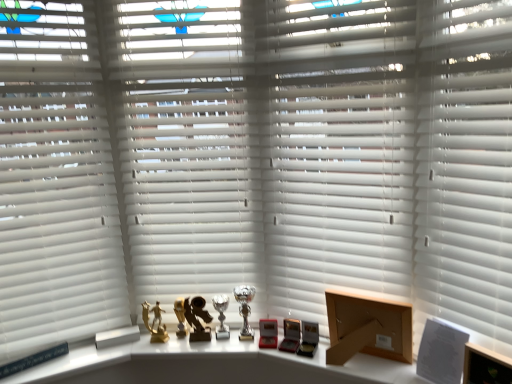
Question: Considering their positions, is gold metallic figurine at center, placed as the 1th toy when sorted from left to right, located in front of or behind silver metallic trophy at center, acting as the first table lamp starting from the right?

Choices:
 (A) behind
 (B) front

Answer: (A)

Question: Choose the correct answer: Is gold metallic figurine at center, which is counted as the second toy, starting from the right, inside silver metallic trophy at center, acting as the first table lamp starting from the right, or outside it?

Choices:
 (A) outside
 (B) inside

Answer: (A)

Question: Which object is the farthest from the wooden box at lower right?

Choices:
 (A) gold metallic figurine at center, which appears as the second toy when viewed from the left
 (B) silver metallic trophy at center, the second table lamp from the right
 (C) white matte blinds at left
 (D) gold metallic trophy at center
 (E) silver metallic trophy at center, the second table lamp viewed from the left

Answer: (C)

Question: Estimate the real-world distances between objects in this image. Which object is farther from the silver metallic trophy at center, which ranks as the first table lamp in left-to-right order?

Choices:
 (A) white matte blinds at center, positioned as the 2th shutter in right-to-left order
 (B) gold metallic trophy at center
 (C) metallic trophies at center
 (D) wooden box at lower right
 (E) white matte shutter at center, positioned as the 1th shutter in right-to-left order

Answer: (E)